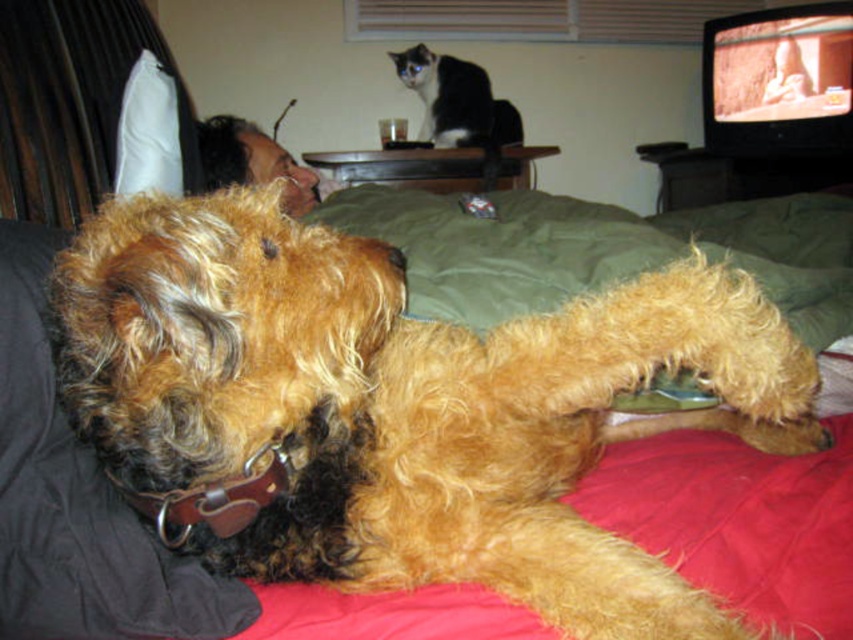
Based on the photo, you are holding a 20 inch long toy and want to toss it to the fuzzy brown dog at center. Can you reach the dog with the toy without moving closer?

The fuzzy brown dog at center is 22.54 inches away from the viewer. Since the toy is 20 inches long, you cannot reach the dog without moving closer.

You are a photographer trying to capture a photo of the fuzzy brown dog at center and the black and white fur at upper center. Since you want both subjects to be in focus, you need to know which one is closer to the camera. Can you determine which animal is closer based on their sizes?

The fuzzy brown dog at center is shorter than the black and white fur at upper center, so the black and white fur at upper center is closer to the camera.

Consider the image. You are a photographer setting up a tripod in the room. The tripod requires a clear space of 0.3 meters in diameter. Can you place the tripod in the center of the room without overlapping with the black and white fur at upper center?

The black and white fur at upper center is located at point (459,106). Since the center of the room would be at coordinates (426,320), the distance between them is sqrt... but since the question is about placement in the center, the distance from the center to the object is sqrt... but since the tripod requires 0.3 meters in diameter, which is 0.15 meters radius. The coordinates are normalized, so the distance between center and the cat is sqrt... but since the exact calculation may be complex, but the x